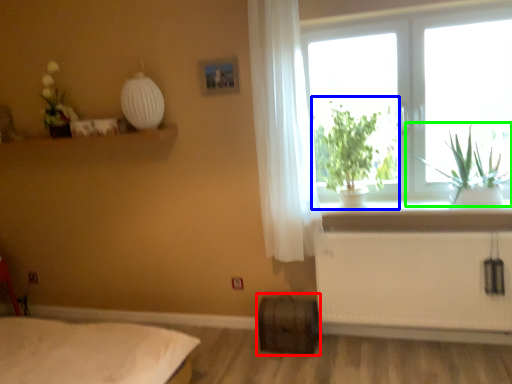
Question: Based on their relative distances, which object is nearer to window box (highlighted by a red box)? Choose from houseplant (highlighted by a blue box) and plant (highlighted by a green box).

Choices:
 (A) houseplant
 (B) plant

Answer: (A)